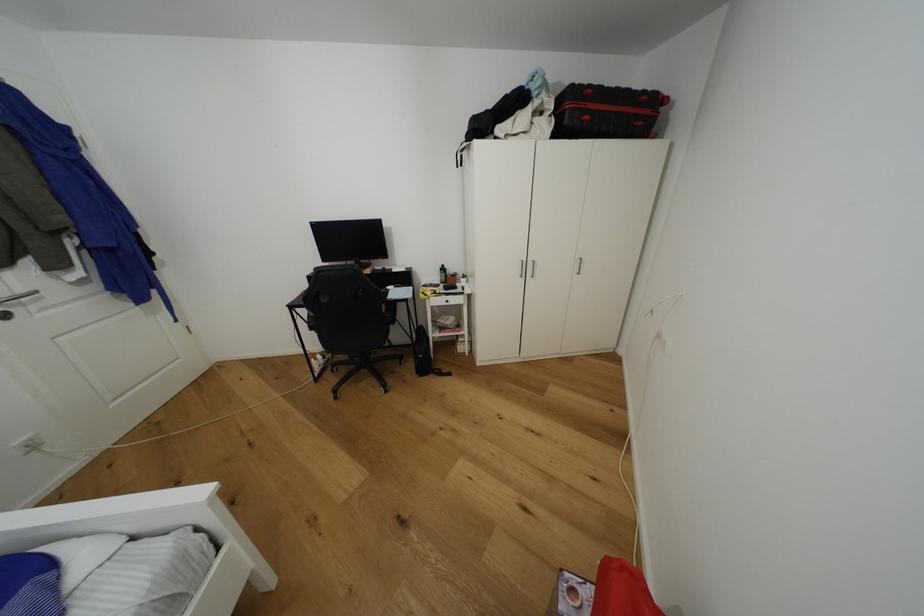
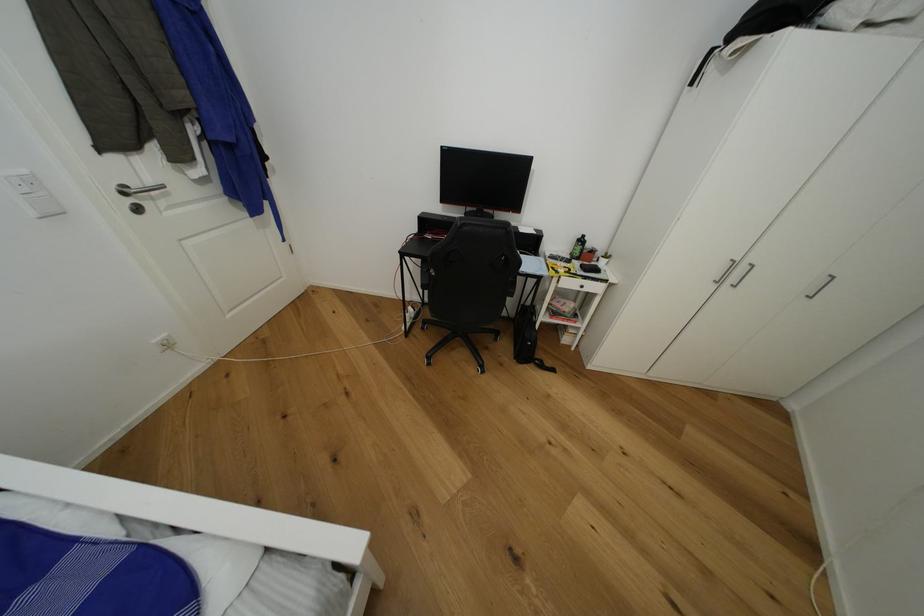
Which direction would the cameraman need to move to produce the second image?

The cameraman moved toward left, forward.